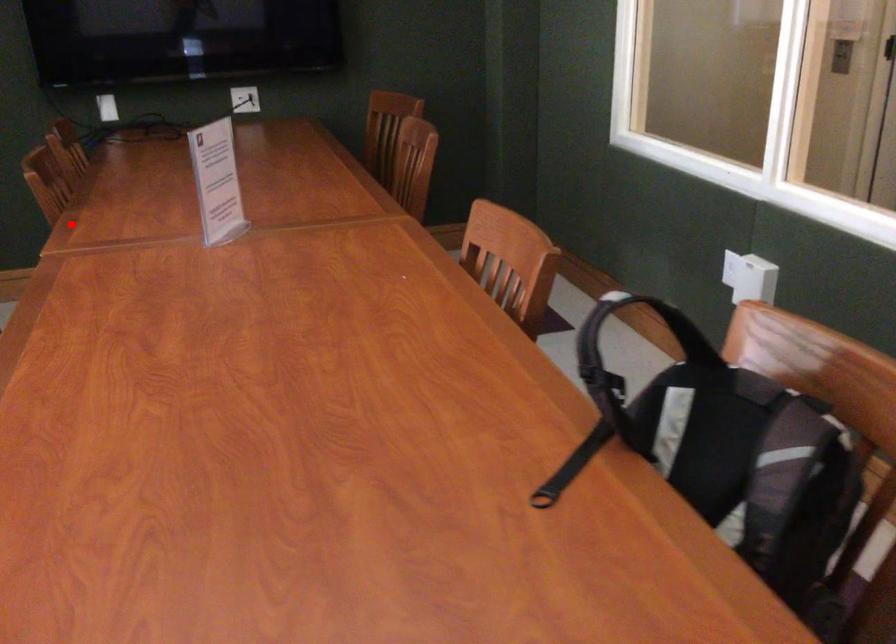
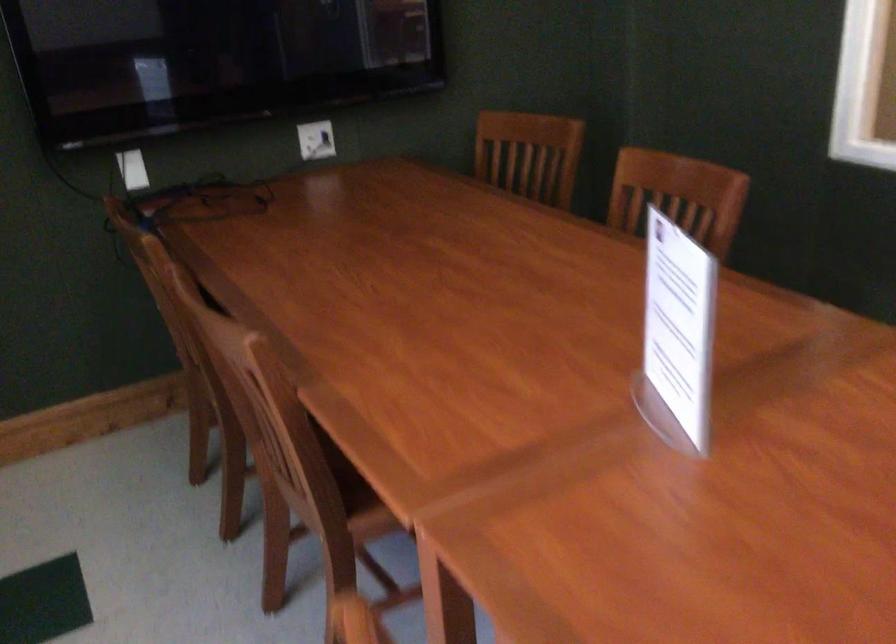
Question: A red point is marked in image1. In image2, is the corresponding 3D point closer to the camera or farther? Reply with the corresponding letter.

Choices:
 (A) The corresponding 3D point is closer.
 (B) The corresponding 3D point is farther.

Answer: (A)